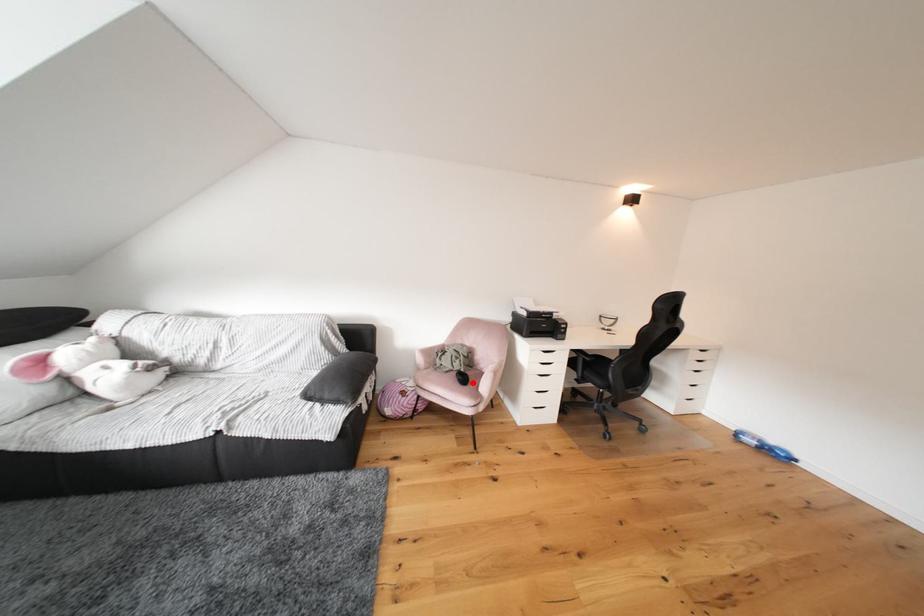
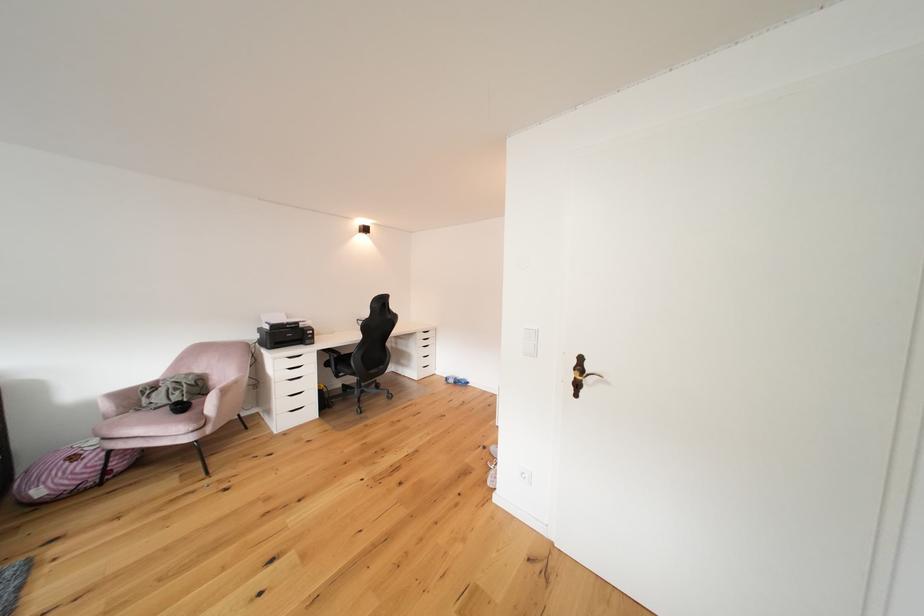
The point at the highlighted location is marked in the first image. Where is the corresponding point in the second image?

(190, 411)